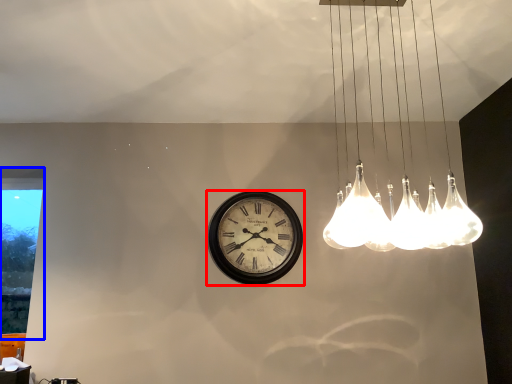
Question: Which point is closer to the camera, wall clock (highlighted by a red box) or window (highlighted by a blue box)?

Choices:
 (A) wall clock
 (B) window

Answer: (A)